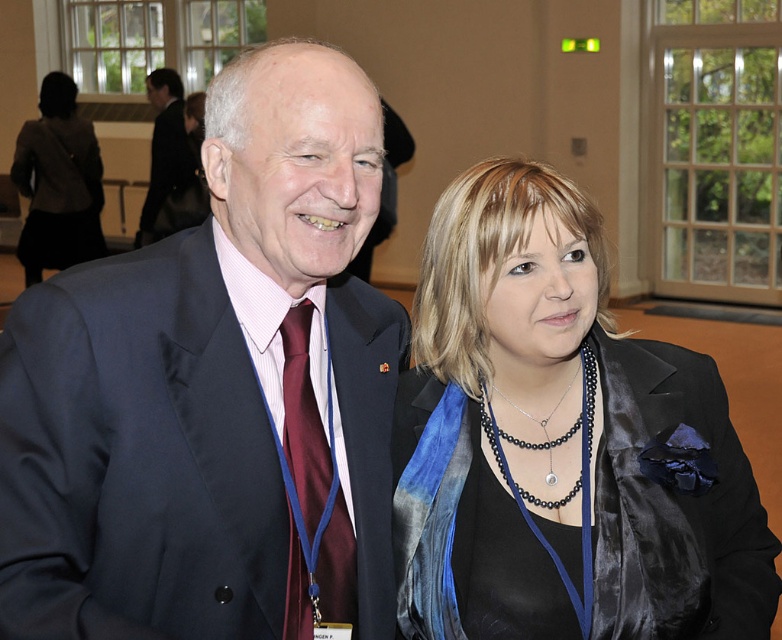
Question: Can you confirm if satin black blazer at center is wider than maroon satin tie at center?

Choices:
 (A) yes
 (B) no

Answer: (A)

Question: Estimate the real-world distances between objects in this image. Which object is farther from the maroon satin tie at center?

Choices:
 (A) satin dark blue suit at center
 (B) satin black blazer at center

Answer: (B)

Question: Among these objects, which one is nearest to the camera?

Choices:
 (A) maroon satin tie at center
 (B) satin dark blue suit at center
 (C) satin black blazer at center

Answer: (B)

Question: Can you confirm if satin dark blue suit at center is positioned to the left of dark gray blazer at left?

Choices:
 (A) no
 (B) yes

Answer: (A)

Question: Among these points, which one is farthest from the camera?

Choices:
 (A) (327, 60)
 (B) (42, 147)

Answer: (B)

Question: Can you confirm if satin dark blue suit at center is smaller than satin black blazer at center?

Choices:
 (A) no
 (B) yes

Answer: (A)